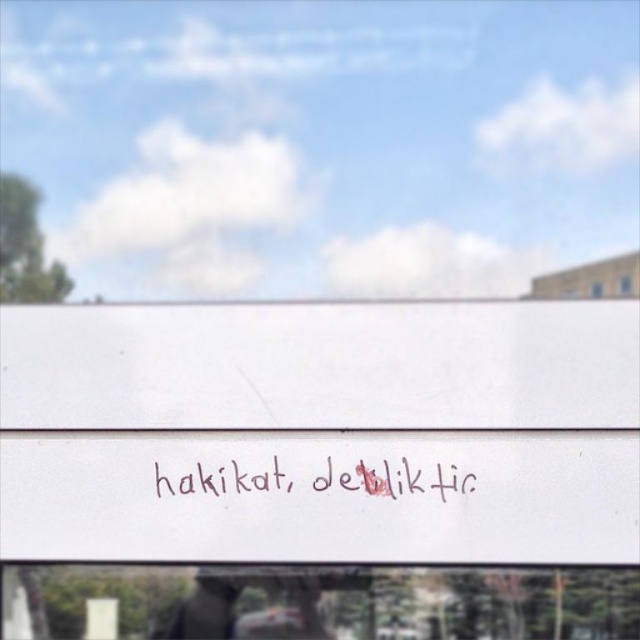
Question: Which point is farther to the camera?

Choices:
 (A) handwritten text at center
 (B) transparent glass window at lower center

Answer: (A)

Question: Is transparent glass window at lower center closer to the viewer compared to handwritten text at center?

Choices:
 (A) yes
 (B) no

Answer: (A)

Question: Does transparent glass window at lower center appear on the left side of handwritten text at center?

Choices:
 (A) yes
 (B) no

Answer: (B)

Question: Among these points, which one is farthest from the camera?

Choices:
 (A) (160, 493)
 (B) (355, 630)

Answer: (B)

Question: Which object appears closest to the camera in this image?

Choices:
 (A) handwritten text at center
 (B) transparent glass window at lower center

Answer: (B)

Question: Is transparent glass window at lower center bigger than handwritten text at center?

Choices:
 (A) yes
 (B) no

Answer: (A)